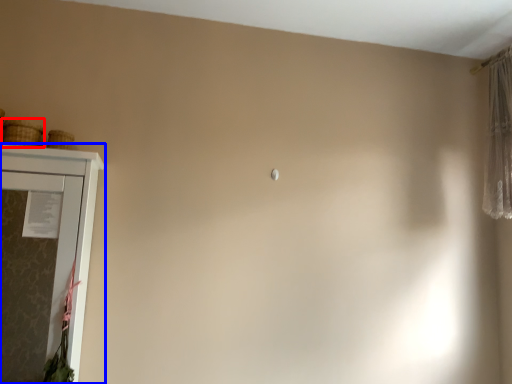
Question: Which of the following is the farthest to the observer, basket (highlighted by a red box) or cupboard (highlighted by a blue box)?

Choices:
 (A) basket
 (B) cupboard

Answer: (A)